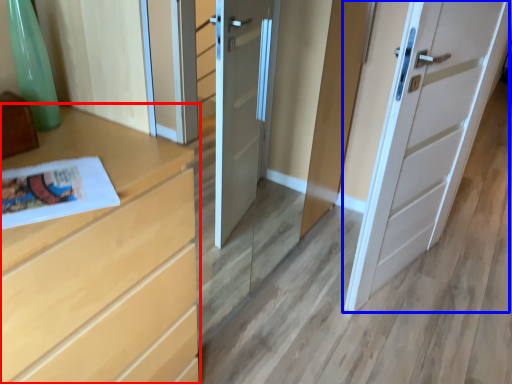
Question: Which of the following is the closest to the observer, chest of drawers (highlighted by a red box) or door (highlighted by a blue box)?

Choices:
 (A) chest of drawers
 (B) door

Answer: (A)